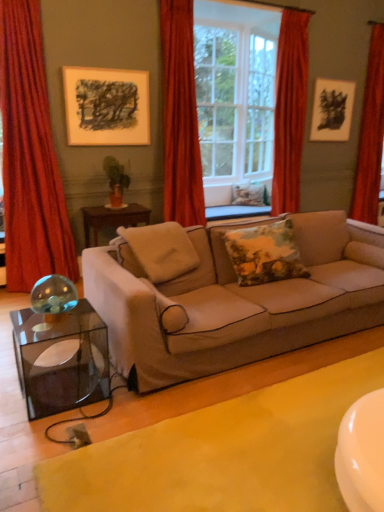
Question: Considering the positions of white glass window frame at center and yellow fabric at lower center in the image, is white glass window frame at center taller or shorter than yellow fabric at lower center?

Choices:
 (A) tall
 (B) short

Answer: (A)

Question: Choose the correct answer: Is white glass window frame at center inside yellow fabric at lower center or outside it?

Choices:
 (A) inside
 (B) outside

Answer: (B)

Question: Estimate the real-world distances between objects in this image. Which object is farther from the red velvet curtain at upper center, the 2th curtain viewed from the right?

Choices:
 (A) clear glass window at center
 (B) velvet red curtain at left, positioned as the first curtain in left-to-right order
 (C) floral fabric pillow at center, the first pillow from the bottom
 (D) yellow fabric at lower center
 (E) matte black picture frame at upper left, which is the 2th picture frame from right to left

Answer: (D)

Question: Which object is positioned farthest from the velvet red curtain at left, positioned as the first curtain in left-to-right order?

Choices:
 (A) red velvet curtain at upper center, the third curtain viewed from the left
 (B) floral fabric pillow at center, the third pillow positioned from the top
 (C) clear glass window at center
 (D) matte black picture frame at upper left, placed as the first picture frame when sorted from left to right
 (E) green matte plant at center

Answer: (C)